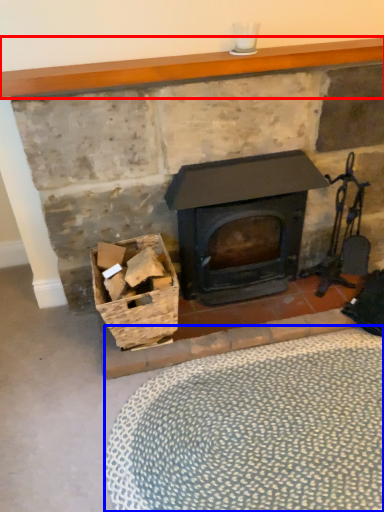
Question: Which point is further to the camera, mantle (highlighted by a red box) or plain (highlighted by a blue box)?

Choices:
 (A) mantle
 (B) plain

Answer: (A)